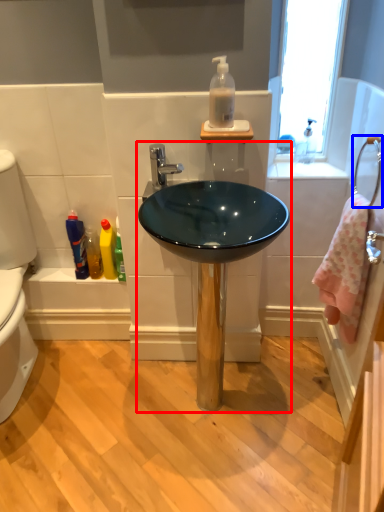
Question: Among these objects, which one is nearest to the camera, sink (highlighted by a red box) or towel bar (highlighted by a blue box)?

Choices:
 (A) sink
 (B) towel bar

Answer: (B)